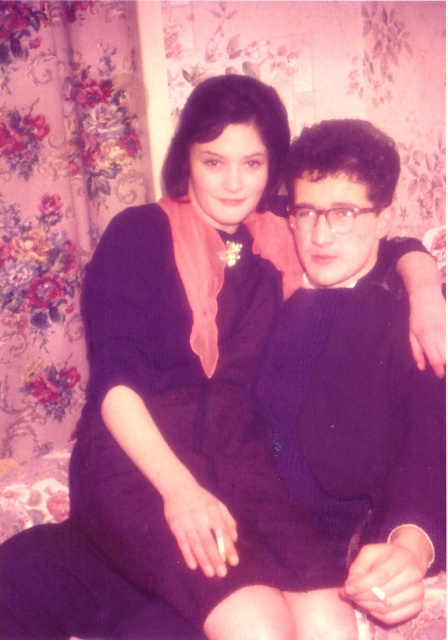
Who is more distant from viewer, (112, 369) or (319, 195)?

The point (319, 195) is behind.

I want to click on matte purple dress at center, so click(x=184, y=417).